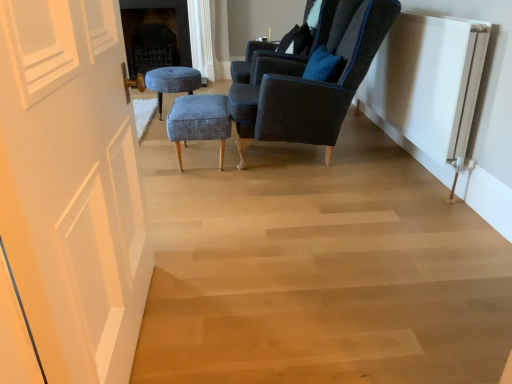
I want to click on unoccupied area in front of velvet dark blue armchair at center, marked as the second chair in a back-to-front arrangement, so [313, 206].